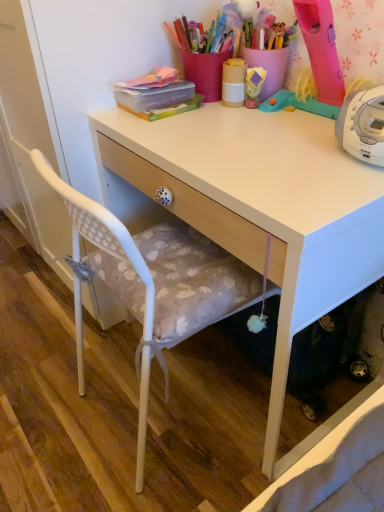
Identify the location of free space that is to the left of white matte desk at center. This screenshot has height=512, width=384. (54, 387).